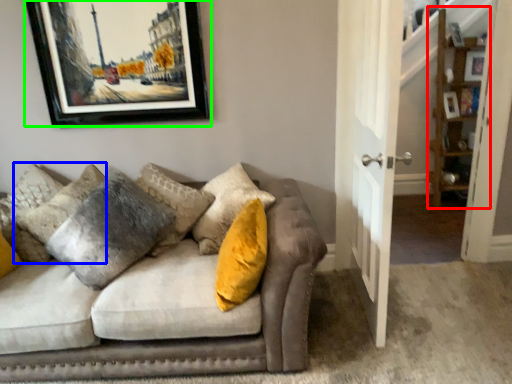
Question: Which object is the closest to the shelf (highlighted by a red box)? Choose among these: pillow (highlighted by a blue box) or picture frame (highlighted by a green box).

Choices:
 (A) pillow
 (B) picture frame

Answer: (B)